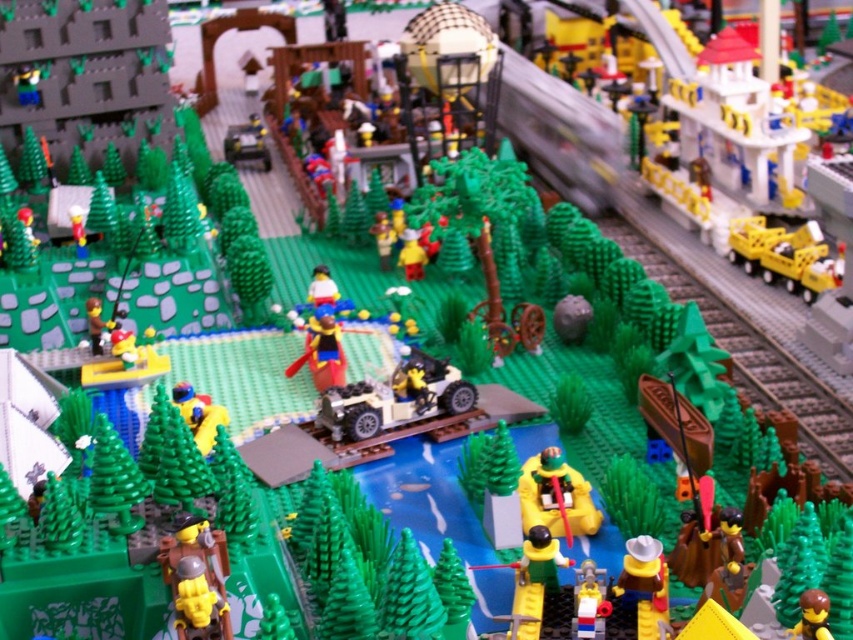
Is yellow matte boat at center to the right of smooth plastic figure at lower center from the viewer's perspective?

Incorrect, yellow matte boat at center is not on the right side of smooth plastic figure at lower center.

How far apart are yellow matte boat at center and smooth plastic figure at lower center?

A distance of 5.12 inches exists between yellow matte boat at center and smooth plastic figure at lower center.

Which is in front, point (577, 490) or point (596, 632)?

Point (596, 632)

Locate an element on the screen. The height and width of the screenshot is (640, 853). yellow matte boat at center is located at coordinates (556, 497).

This screenshot has height=640, width=853. Find the location of `smooth yellow boat at center`. smooth yellow boat at center is located at coordinates (322, 352).

Is point (315, 326) behind point (598, 632)?

Yes, it is behind point (598, 632).

Is point (318, 380) behind point (604, 579)?

Yes, point (318, 380) is behind point (604, 579).

Where is `smooth yellow boat at center`? The height and width of the screenshot is (640, 853). smooth yellow boat at center is located at coordinates (322, 352).

Can you confirm if yellow matte boat at center is positioned above matte yellow cowboy hat at lower right?

Indeed, yellow matte boat at center is positioned over matte yellow cowboy hat at lower right.

Is yellow matte boat at center wider than matte yellow cowboy hat at lower right?

Indeed, yellow matte boat at center has a greater width compared to matte yellow cowboy hat at lower right.

Does point (521, 483) come behind point (660, 572)?

Yes, it is.

The width and height of the screenshot is (853, 640). I want to click on yellow matte boat at center, so click(x=556, y=497).